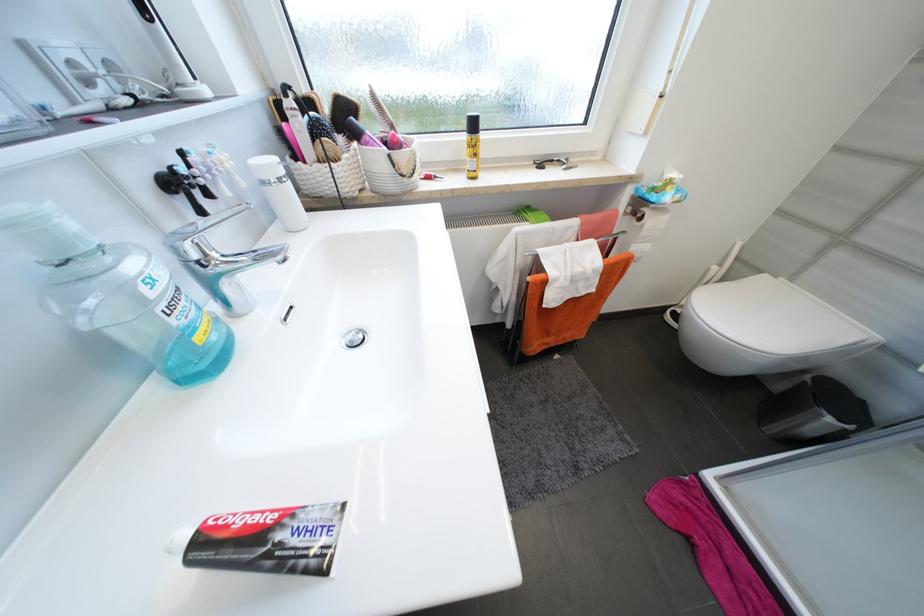
In order to click on blue mouthwash bottle in this screenshot , I will do `click(118, 294)`.